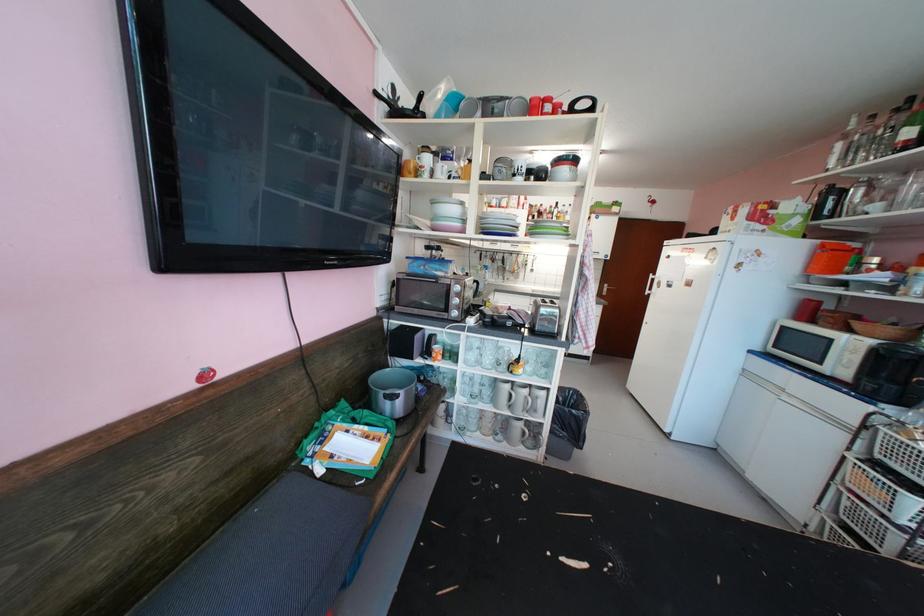
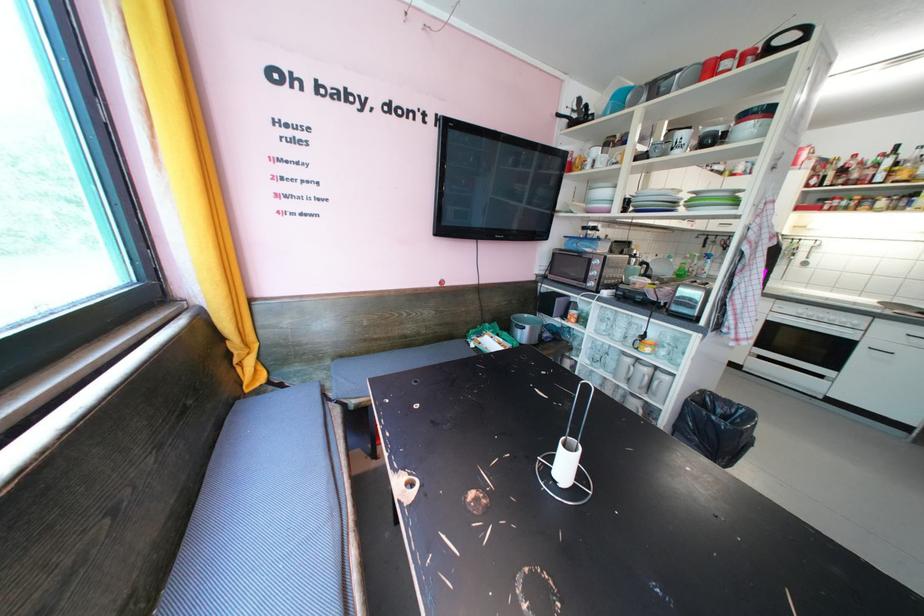
Where in the second image is the point corresponding to (456,289) from the first image?

(599, 262)